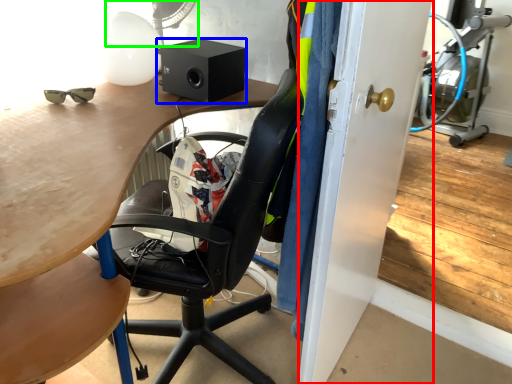
Question: Which is farther away from glass door (highlighted by a red box)? loudspeaker (highlighted by a blue box) or mechanical fan (highlighted by a green box)?

Choices:
 (A) loudspeaker
 (B) mechanical fan

Answer: (B)